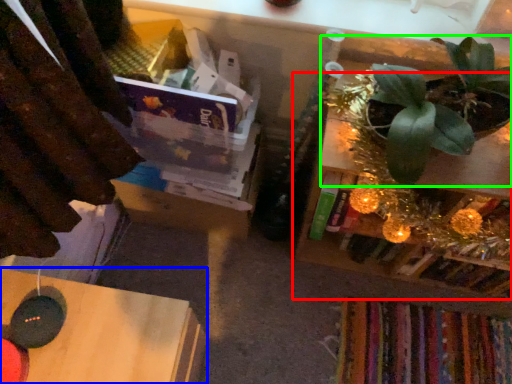
Question: Based on their relative distances, which object is nearer to shelf (highlighted by a red box)? Choose from table (highlighted by a blue box) and houseplant (highlighted by a green box).

Choices:
 (A) table
 (B) houseplant

Answer: (B)